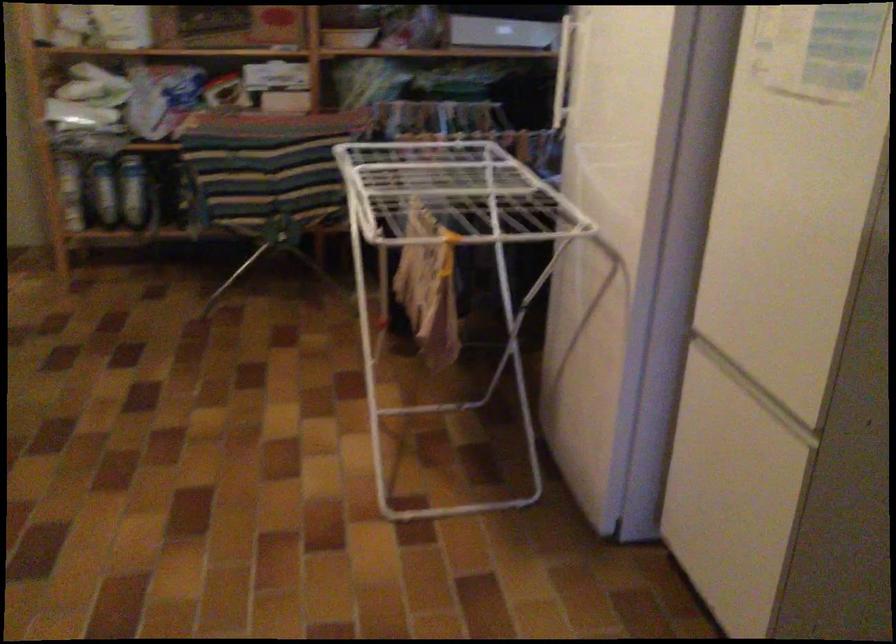
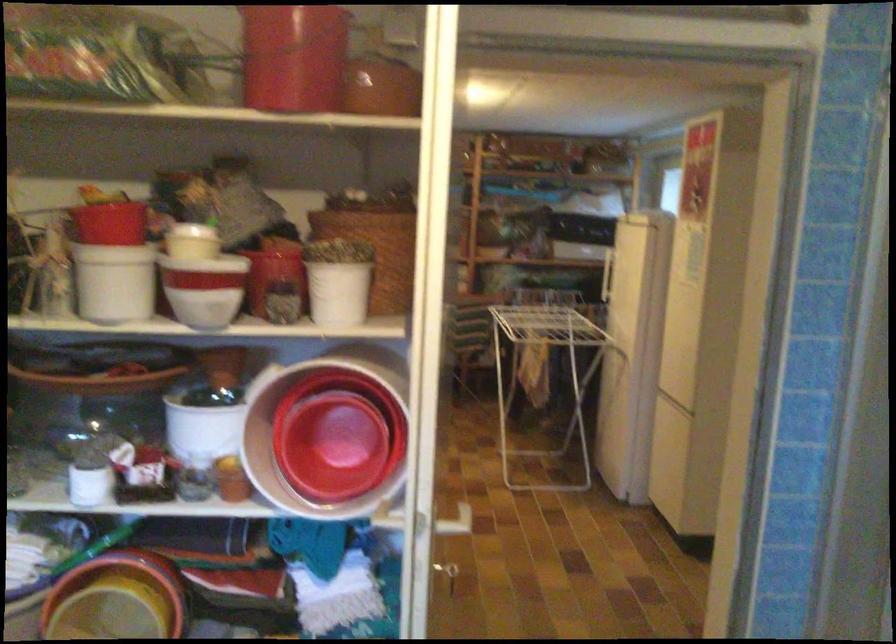
Question: I am providing you with two images of the same scene from different viewpoints. Please identify which objects are invisible in image2.

Choices:
 (A) freezer door handle
 (B) red plastic bucket
 (C) blue table marker
 (D) white drying rack

Answer: (A)